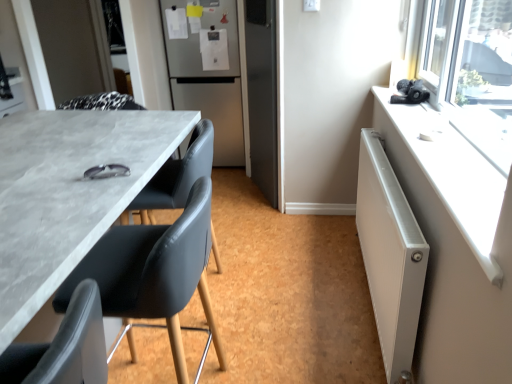
Question: Considering their positions, is white plastic radiator at upper right located in front of or behind white metallic radiator at right?

Choices:
 (A) front
 (B) behind

Answer: (A)

Question: From the image's perspective, is white plastic radiator at upper right located above or below white metallic radiator at right?

Choices:
 (A) below
 (B) above

Answer: (B)

Question: Which of these objects is positioned closest to the satin silver refrigerator at center?

Choices:
 (A) matte gray table at left
 (B) matte black chair at left, arranged as the 2th chair when viewed from the back
 (C) white metallic radiator at right
 (D) matte black chair at center, which appears as the third chair when viewed from the front
 (E) white plastic radiator at upper right

Answer: (A)

Question: Based on their relative distances, which object is nearer to the white metallic radiator at right?

Choices:
 (A) matte black chair at left, positioned as the second chair in front-to-back order
 (B) matte black chair at center, which appears as the third chair when viewed from the front
 (C) black leather chair at lower left, which appears as the 3th chair when viewed from the back
 (D) matte gray table at left
 (E) white plastic radiator at upper right

Answer: (E)